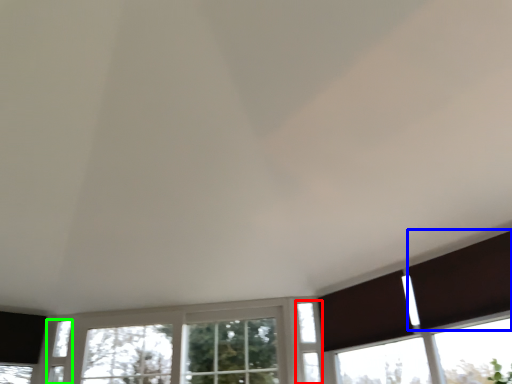
Question: Which object is the farthest from window (highlighted by a red box)? Choose among these: shutter (highlighted by a blue box) or window (highlighted by a green box).

Choices:
 (A) shutter
 (B) window

Answer: (B)